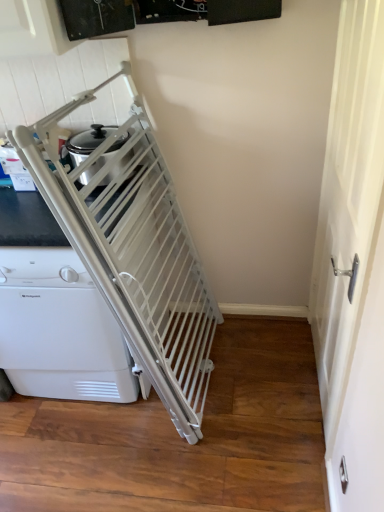
Question: Is white plastic gate at left shorter than white matte screen door at right?

Choices:
 (A) yes
 (B) no

Answer: (A)

Question: Can you confirm if white plastic gate at left is positioned to the left of white matte screen door at right?

Choices:
 (A) yes
 (B) no

Answer: (A)

Question: Could you tell me if white plastic gate at left is facing white matte screen door at right?

Choices:
 (A) yes
 (B) no

Answer: (B)

Question: Is white plastic gate at left not inside white matte screen door at right?

Choices:
 (A) no
 (B) yes

Answer: (B)

Question: Is white plastic gate at left closer to the viewer compared to white matte screen door at right?

Choices:
 (A) no
 (B) yes

Answer: (A)

Question: Is white plastic gate at left smaller than white matte screen door at right?

Choices:
 (A) yes
 (B) no

Answer: (B)

Question: Is white matte screen door at right shorter than white plastic gate at left?

Choices:
 (A) yes
 (B) no

Answer: (B)

Question: From a real-world perspective, does white matte screen door at right stand above white plastic gate at left?

Choices:
 (A) no
 (B) yes

Answer: (B)

Question: Is white matte screen door at right not inside white plastic gate at left?

Choices:
 (A) no
 (B) yes

Answer: (B)

Question: Can you confirm if white matte screen door at right is thinner than white plastic gate at left?

Choices:
 (A) no
 (B) yes

Answer: (B)

Question: Does white matte screen door at right have a smaller size compared to white plastic gate at left?

Choices:
 (A) no
 (B) yes

Answer: (B)

Question: Is white matte screen door at right not near white plastic gate at left?

Choices:
 (A) yes
 (B) no

Answer: (A)

Question: From a real-world perspective, is white matte screen door at right positioned above or below white plastic gate at left?

Choices:
 (A) above
 (B) below

Answer: (A)